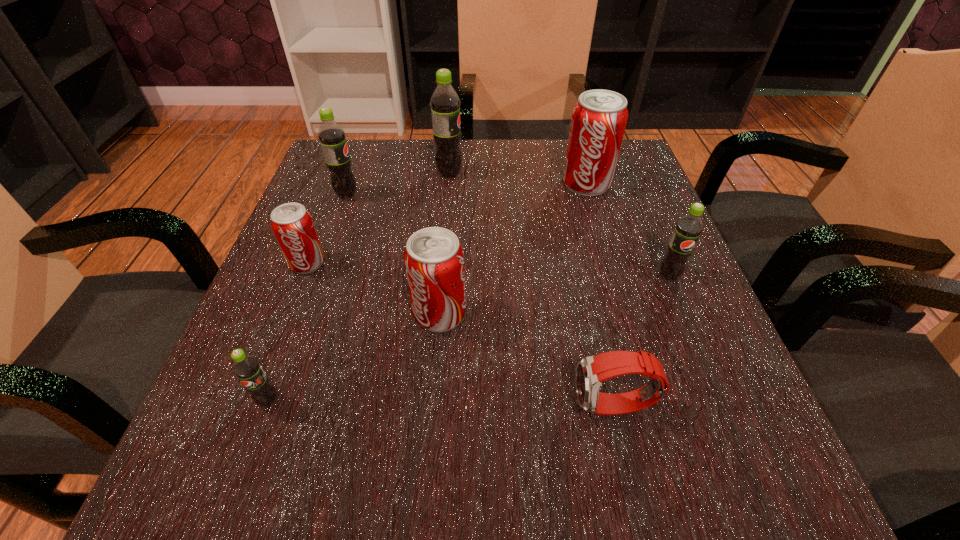
Locate an element on the screen. the biggest green soda is located at coordinates (445, 103).

In order to click on the third green soda from left to right in this screenshot , I will do `click(445, 103)`.

Where is `the farthest red soda can`? The height and width of the screenshot is (540, 960). the farthest red soda can is located at coordinates (599, 118).

At what (x,y) coordinates should I click in order to perform the action: click on the biggest red soda can. Please return your answer as a coordinate pair (x, y). The width and height of the screenshot is (960, 540). Looking at the image, I should click on (599, 118).

At what (x,y) coordinates should I click in order to perform the action: click on the third nearest green soda. Please return your answer as a coordinate pair (x, y). The width and height of the screenshot is (960, 540). Looking at the image, I should click on (332, 137).

Identify the location of the rightmost soda. (688, 228).

Image resolution: width=960 pixels, height=540 pixels. I want to click on the second smallest green soda, so click(688, 228).

The width and height of the screenshot is (960, 540). In order to click on the second biggest red soda can in this screenshot , I will do `click(434, 259)`.

This screenshot has height=540, width=960. In order to click on the sixth farthest object in this screenshot , I will do `click(434, 259)`.

At what (x,y) coordinates should I click in order to perform the action: click on the second farthest red soda can. Please return your answer as a coordinate pair (x, y). The width and height of the screenshot is (960, 540). Looking at the image, I should click on (292, 224).